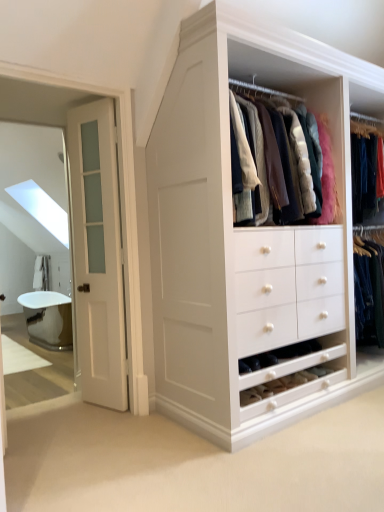
Question: Can you confirm if white frosted glass door at left is smaller than silver metallic bathtub at left?

Choices:
 (A) no
 (B) yes

Answer: (B)

Question: Can you confirm if white frosted glass door at left is positioned to the right of silver metallic bathtub at left?

Choices:
 (A) yes
 (B) no

Answer: (A)

Question: Are white frosted glass door at left and silver metallic bathtub at left located far from each other?

Choices:
 (A) yes
 (B) no

Answer: (A)

Question: Is white frosted glass door at left positioned in front of silver metallic bathtub at left?

Choices:
 (A) no
 (B) yes

Answer: (B)

Question: Is white frosted glass door at left further to the viewer compared to silver metallic bathtub at left?

Choices:
 (A) yes
 (B) no

Answer: (B)

Question: From the image's perspective, is white frosted glass door at left beneath silver metallic bathtub at left?

Choices:
 (A) no
 (B) yes

Answer: (A)

Question: Considering the relative positions of silver metallic bathtub at left and white frosted glass door at left in the image provided, is silver metallic bathtub at left to the right of white frosted glass door at left from the viewer's perspective?

Choices:
 (A) yes
 (B) no

Answer: (B)

Question: Is silver metallic bathtub at left behind white frosted glass door at left?

Choices:
 (A) yes
 (B) no

Answer: (A)

Question: Is silver metallic bathtub at left aimed at white frosted glass door at left?

Choices:
 (A) yes
 (B) no

Answer: (B)

Question: Is silver metallic bathtub at left to the left of white frosted glass door at left from the viewer's perspective?

Choices:
 (A) yes
 (B) no

Answer: (A)

Question: Is silver metallic bathtub at left not within white frosted glass door at left?

Choices:
 (A) no
 (B) yes

Answer: (B)

Question: Does silver metallic bathtub at left have a greater width compared to white frosted glass door at left?

Choices:
 (A) no
 (B) yes

Answer: (B)

Question: Does point (59, 292) appear closer or farther from the camera than point (104, 379)?

Choices:
 (A) farther
 (B) closer

Answer: (A)